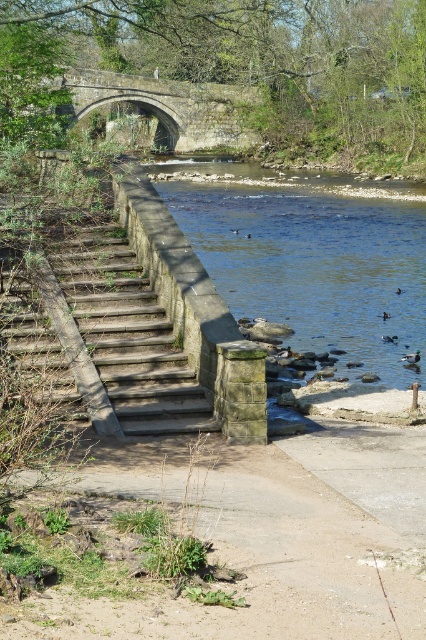
Which is more to the left, blue stone river at lower center or stone arch bridge at upper center?

stone arch bridge at upper center

Does blue stone river at lower center have a larger size compared to stone arch bridge at upper center?

No, blue stone river at lower center is not bigger than stone arch bridge at upper center.

Does point (351, 310) lie in front of point (112, 72)?

Yes.

You are a GUI agent. You are given a task and a screenshot of the screen. Output one action in this format:
    pyautogui.click(x=<x>, y=<y>)
    Task: Click on the blue stone river at lower center
    The height and width of the screenshot is (640, 426).
    Given the screenshot: What is the action you would take?
    pyautogui.click(x=310, y=256)

In the scene shown: Can you confirm if stone arch bridge at upper center is positioned to the left of brown fuzzy duck at center?

Indeed, stone arch bridge at upper center is positioned on the left side of brown fuzzy duck at center.

Who is higher up, stone arch bridge at upper center or brown fuzzy duck at center?

Positioned higher is stone arch bridge at upper center.

At what (x,y) coordinates should I click in order to perform the action: click on stone arch bridge at upper center. Please return your answer as a coordinate pair (x, y). Image resolution: width=426 pixels, height=640 pixels. Looking at the image, I should click on (166, 106).

The image size is (426, 640). I want to click on stone arch bridge at upper center, so click(x=166, y=106).

Is point (279, 461) closer to viewer compared to point (129, 401)?

Yes, point (279, 461) is closer to viewer.

I want to click on concrete sidewalk at lower center, so click(x=275, y=544).

Find the location of a particular element. The width and height of the screenshot is (426, 640). concrete sidewalk at lower center is located at coordinates (275, 544).